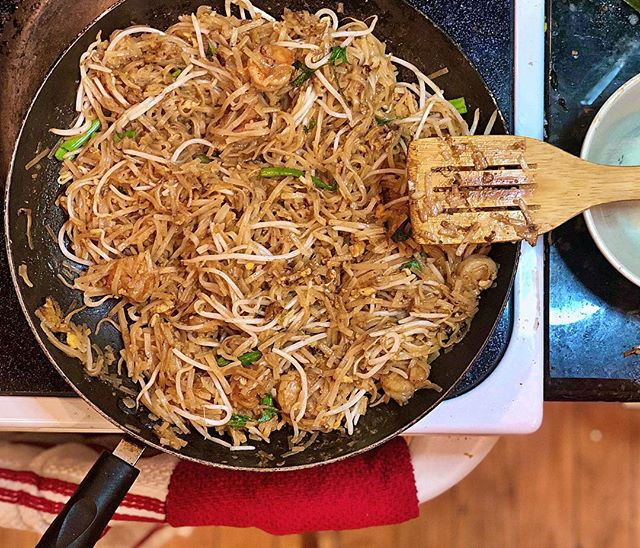
Locate an element on the screen. red dish towel is located at coordinates (323, 502).